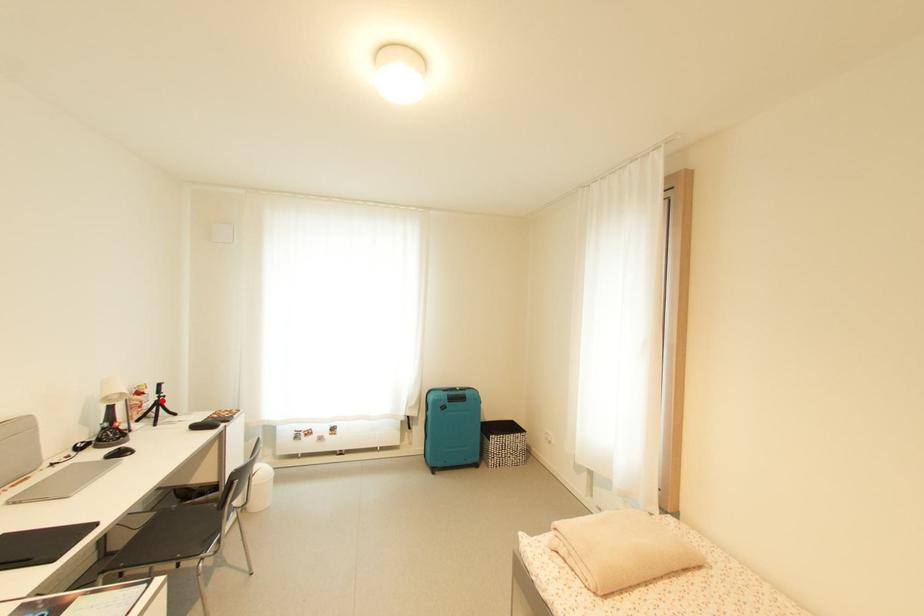
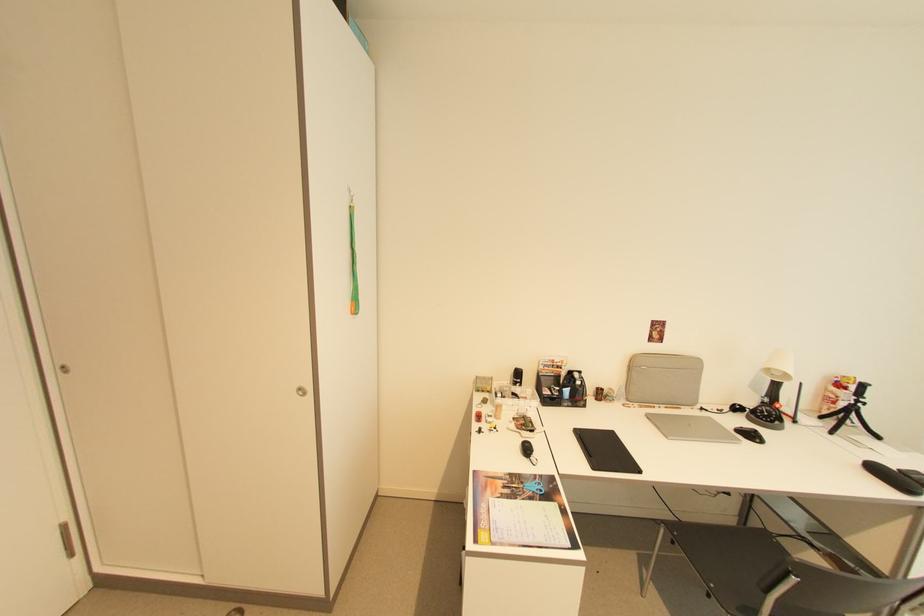
Question: I am providing you with two images of the same scene from different viewpoints. A red point is shown in image1. For the corresponding object point in image2, is it positioned nearer or farther from the camera?

Choices:
 (A) Nearer
 (B) Farther

Answer: (A)